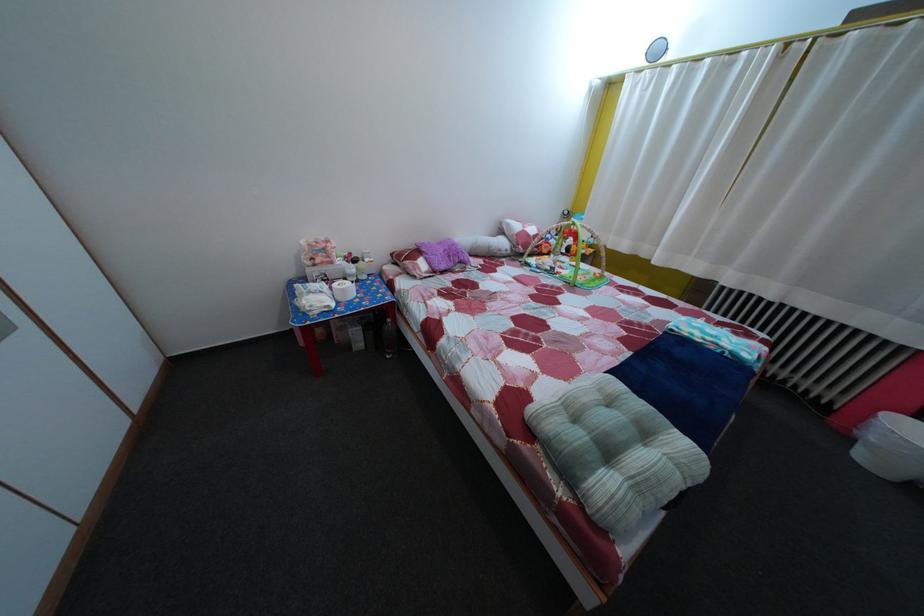
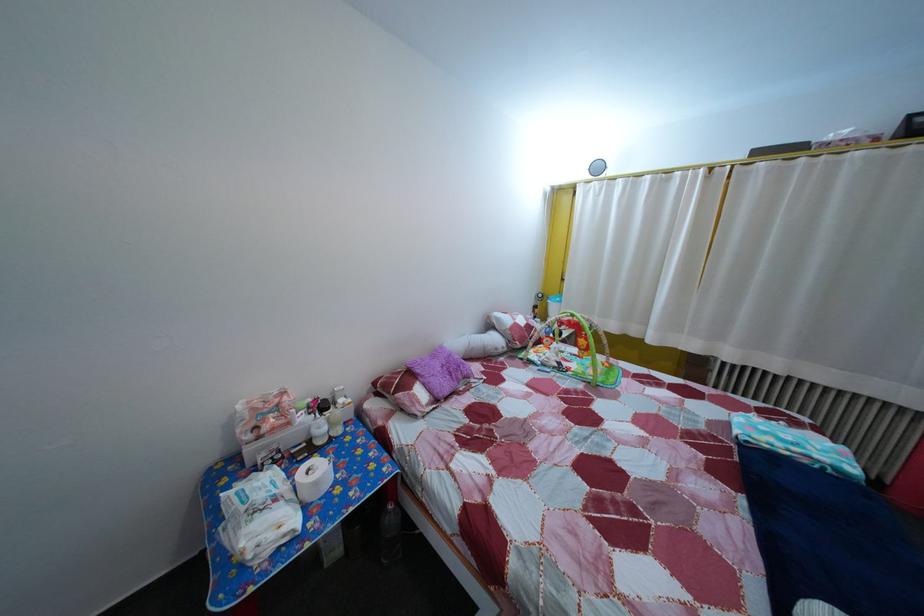
The point at (512, 251) is marked in the first image. Where is the corresponding point in the second image?

(505, 347)